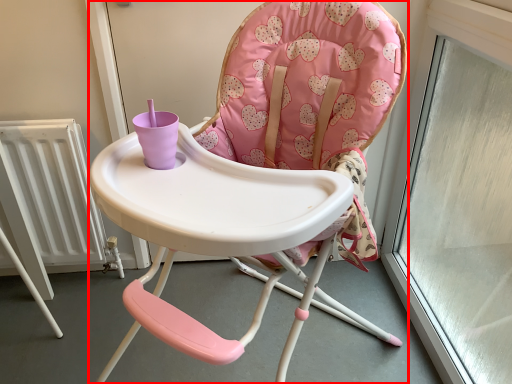
Question: Observing the image, what is the correct spatial positioning of chair (annotated by the red box) in reference to radiator?

Choices:
 (A) right
 (B) left

Answer: (A)